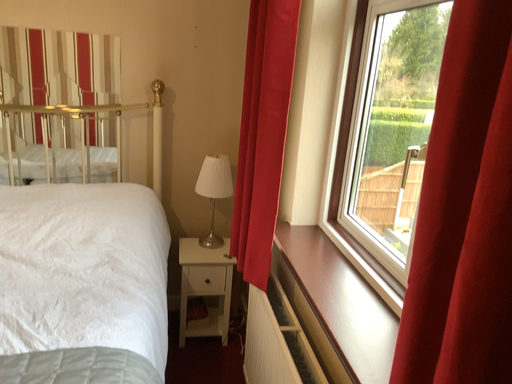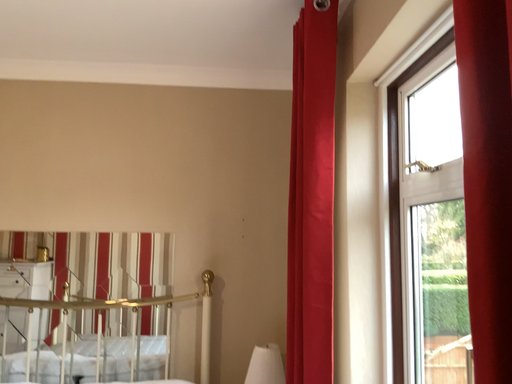
Question: Which way did the camera rotate in the video?

Choices:
 (A) rotated left
 (B) rotated right

Answer: (A)